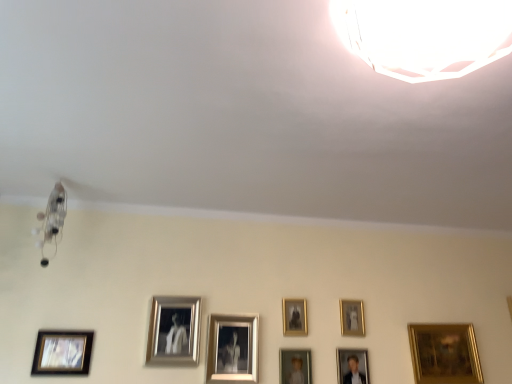
Question: Can you confirm if white plastic lamp at upper right, which appears as the first lamp when viewed from the right, is taller than gold metallic picture frame at lower right, positioned as the eighth picture frame in left-to-right order?

Choices:
 (A) yes
 (B) no

Answer: (B)

Question: From a real-world perspective, is white plastic lamp at upper right, which appears as the first lamp when viewed from the right, located beneath gold metallic picture frame at lower right, which is counted as the 1th picture frame, starting from the right?

Choices:
 (A) no
 (B) yes

Answer: (A)

Question: From the image's perspective, would you say white plastic lamp at upper right, the 1th lamp viewed from the top, is positioned over gold metallic picture frame at lower right, which is counted as the 1th picture frame, starting from the right?

Choices:
 (A) no
 (B) yes

Answer: (B)

Question: Could you tell me if white plastic lamp at upper right, which is the 2th lamp in left-to-right order, is facing gold metallic picture frame at lower right, positioned as the eighth picture frame in left-to-right order?

Choices:
 (A) no
 (B) yes

Answer: (A)

Question: Is there a large distance between white plastic lamp at upper right, acting as the 1th lamp starting from the front, and gold metallic picture frame at lower right, which is counted as the 1th picture frame, starting from the right?

Choices:
 (A) no
 (B) yes

Answer: (B)

Question: From a real-world perspective, is white plastic lamp at upper right, acting as the 1th lamp starting from the front, on gold metallic picture frame at lower right, which is counted as the 1th picture frame, starting from the right?

Choices:
 (A) no
 (B) yes

Answer: (B)

Question: Is gold metallic picture frame at center, positioned as the sixth picture frame in right-to-left order, facing away from gold-framed photo at lower left, arranged as the 1th picture frame when viewed from the left?

Choices:
 (A) yes
 (B) no

Answer: (B)

Question: Can you confirm if gold metallic picture frame at center, positioned as the sixth picture frame in right-to-left order, is shorter than gold-framed photo at lower left, arranged as the 1th picture frame when viewed from the left?

Choices:
 (A) yes
 (B) no

Answer: (B)

Question: Considering the relative sizes of gold metallic picture frame at center, positioned as the sixth picture frame in right-to-left order, and gold-framed photo at lower left, arranged as the 1th picture frame when viewed from the left, in the image provided, is gold metallic picture frame at center, positioned as the sixth picture frame in right-to-left order, smaller than gold-framed photo at lower left, arranged as the 1th picture frame when viewed from the left,?

Choices:
 (A) yes
 (B) no

Answer: (B)

Question: From the image's perspective, is gold metallic picture frame at center, positioned as the sixth picture frame in right-to-left order, beneath gold-framed photo at lower left, arranged as the 1th picture frame when viewed from the left?

Choices:
 (A) yes
 (B) no

Answer: (A)

Question: Can you confirm if gold metallic picture frame at center, positioned as the sixth picture frame in right-to-left order, is positioned to the right of gold-framed photo at lower left, which is the eighth picture frame from right to left?

Choices:
 (A) yes
 (B) no

Answer: (A)

Question: Can you confirm if gold metallic picture frame at center, placed as the 3th picture frame when sorted from left to right, is wider than gold-framed photo at lower left, arranged as the 1th picture frame when viewed from the left?

Choices:
 (A) no
 (B) yes

Answer: (B)

Question: Is silver metallic picture frame at center, which is the seventh picture frame in right-to-left order, taller than gold metallic picture frame at upper right, the seventh picture frame positioned from the left?

Choices:
 (A) no
 (B) yes

Answer: (B)